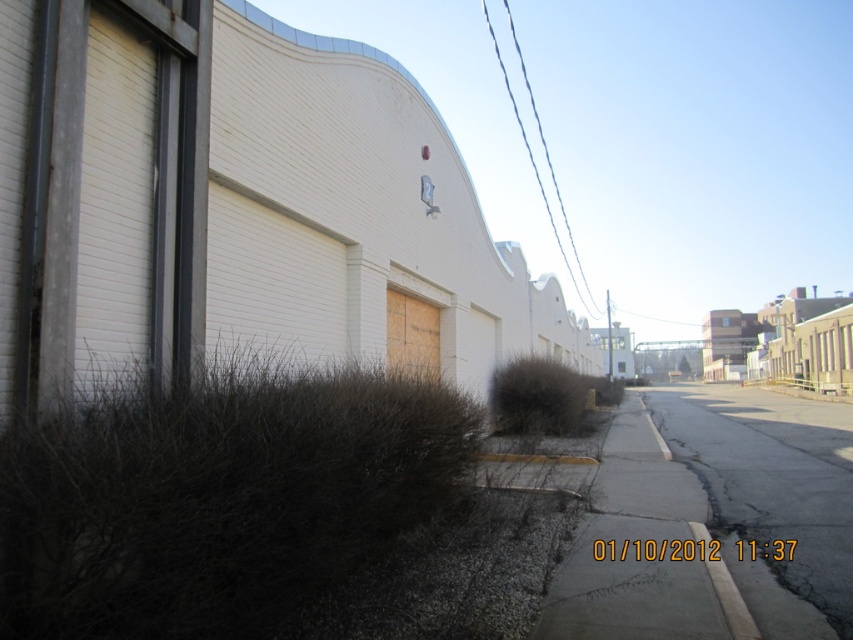
Question: Observing the image, what is the correct spatial positioning of wooden boarded garage door at center in reference to gray concrete curb at lower right?

Choices:
 (A) right
 (B) left

Answer: (B)

Question: Which point is farther to the camera?

Choices:
 (A) wooden boarded garage door at center
 (B) black asphalt road at center
 (C) gray concrete curb at lower right
 (D) gray asphalt pavement at center

Answer: (A)

Question: Considering the relative positions of black asphalt road at center and gray asphalt pavement at center in the image provided, where is black asphalt road at center located with respect to gray asphalt pavement at center?

Choices:
 (A) below
 (B) above

Answer: (A)

Question: Considering the relative positions of black asphalt road at center and gray asphalt pavement at center in the image provided, where is black asphalt road at center located with respect to gray asphalt pavement at center?

Choices:
 (A) below
 (B) above

Answer: (A)

Question: Among these points, which one is nearest to the camera?

Choices:
 (A) (390, 336)
 (B) (740, 605)
 (C) (579, 618)

Answer: (C)

Question: Among these points, which one is farthest from the camera?

Choices:
 (A) (737, 624)
 (B) (428, 339)
 (C) (585, 573)

Answer: (B)